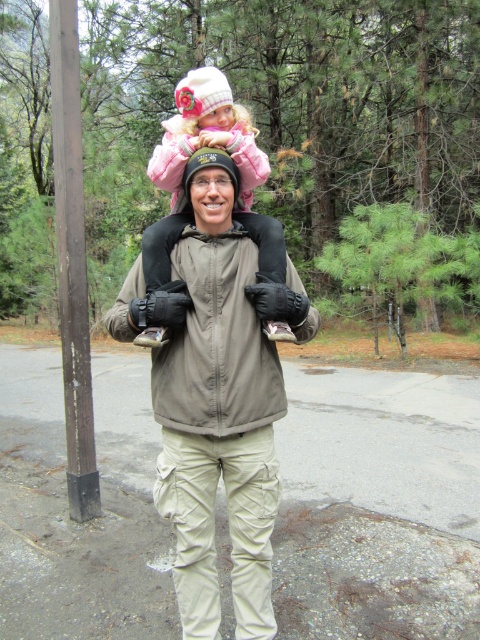
Who is taller, tan fabric backpack at center or pink fleece jacket at upper center?

Standing taller between the two is tan fabric backpack at center.

From the picture: Is tan fabric backpack at center shorter than pink fleece jacket at upper center?

No.

Between point (188, 376) and point (283, 256), which one is positioned in front?

Point (188, 376) is more forward.

What are the coordinates of `tan fabric backpack at center` in the screenshot? It's located at (216, 401).